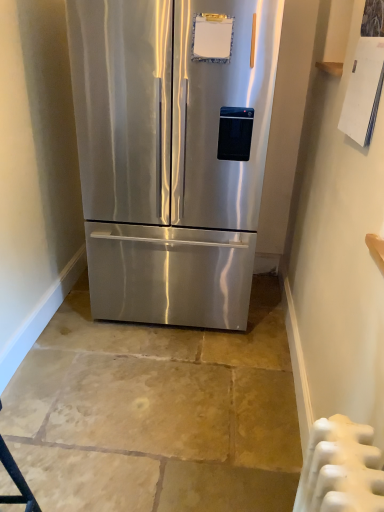
Question: Which is correct: stainless steel refrigerator at center is inside white plastic radiator at lower right, or outside of it?

Choices:
 (A) outside
 (B) inside

Answer: (A)

Question: Does point (228, 117) appear closer or farther from the camera than point (374, 445)?

Choices:
 (A) farther
 (B) closer

Answer: (A)

Question: From a real-world perspective, is stainless steel refrigerator at center physically located above or below white plastic radiator at lower right?

Choices:
 (A) below
 (B) above

Answer: (B)

Question: Considering the positions of white plastic radiator at lower right and stainless steel refrigerator at center in the image, is white plastic radiator at lower right taller or shorter than stainless steel refrigerator at center?

Choices:
 (A) short
 (B) tall

Answer: (A)

Question: In terms of width, does white plastic radiator at lower right look wider or thinner when compared to stainless steel refrigerator at center?

Choices:
 (A) thin
 (B) wide

Answer: (A)

Question: Visually, is white plastic radiator at lower right positioned to the left or to the right of stainless steel refrigerator at center?

Choices:
 (A) right
 (B) left

Answer: (A)

Question: Is white plastic radiator at lower right inside or outside of stainless steel refrigerator at center?

Choices:
 (A) outside
 (B) inside

Answer: (A)